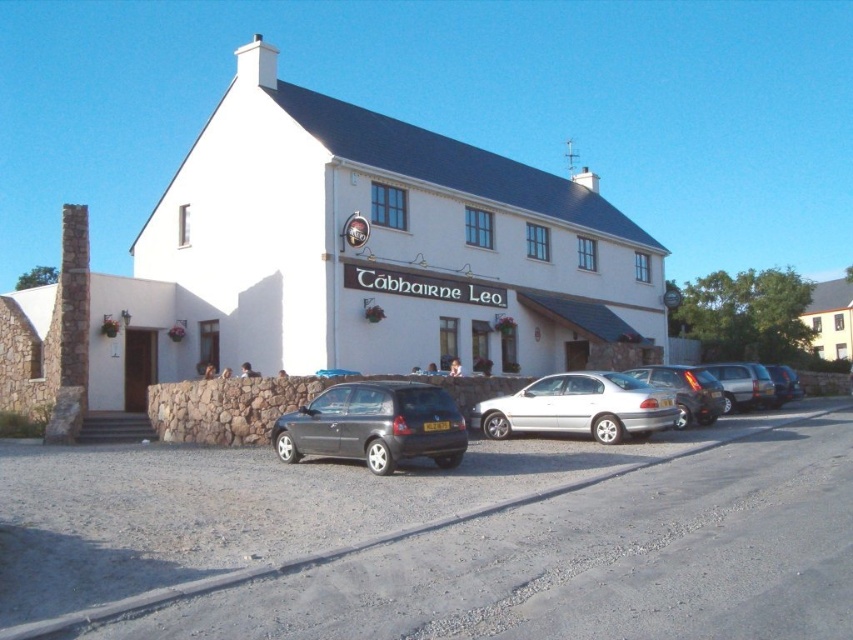
Question: Which point is closer to the camera taking this photo?

Choices:
 (A) (283, 422)
 (B) (827, 298)
 (C) (792, 385)
 (D) (728, 385)

Answer: (A)

Question: Which point is farther from the camera taking this photo?

Choices:
 (A) (792, 381)
 (B) (845, 284)
 (C) (563, 396)

Answer: (B)

Question: Among these objects, which one is farthest from the camera?

Choices:
 (A) white matte building at center
 (B) matte gray hatchback at center
 (C) silver metallic hatchback at right

Answer: (C)

Question: Does metallic silver sedan at center appear on the left side of metallic silver car at center?

Choices:
 (A) yes
 (B) no

Answer: (A)

Question: Does silver metallic car at center appear over metallic silver car at center?

Choices:
 (A) no
 (B) yes

Answer: (B)

Question: Does white matte building at center come in front of metallic silver sedan at center?

Choices:
 (A) no
 (B) yes

Answer: (B)